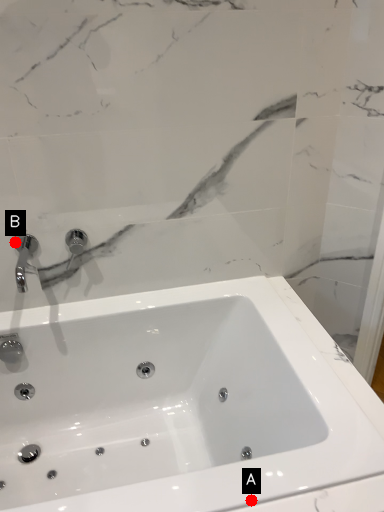
Question: Two points are circled on the image, labeled by A and B beside each circle. Which of the following is the farthest from the observer?

Choices:
 (A) A is further
 (B) B is further

Answer: (B)